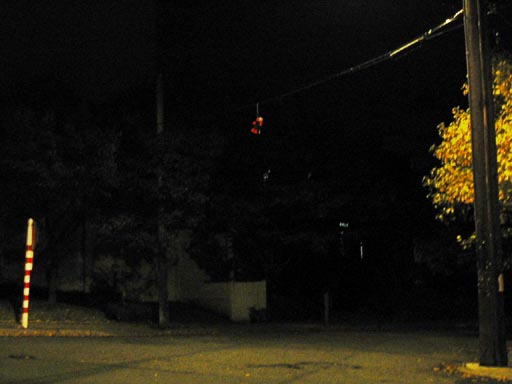
At what (x,y) coordinates should I click in order to perform the action: click on wall. Please return your answer as a coordinate pair (x, y). This screenshot has width=512, height=384. Looking at the image, I should click on (237, 300).